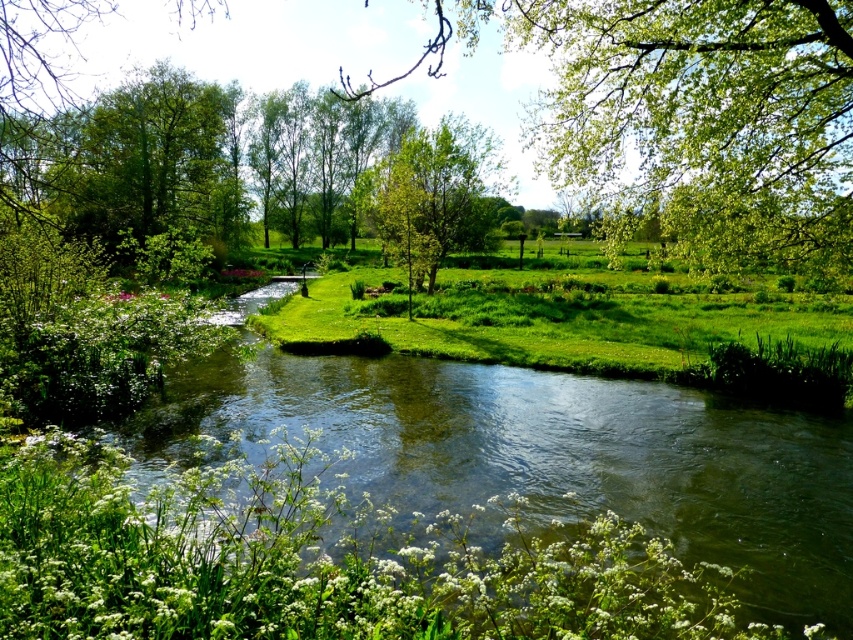
Who is shorter, green leafy tree at upper left or green leafy tree at center?

green leafy tree at center is shorter.

Which is above, green leafy tree at upper left or green leafy tree at center?

green leafy tree at upper left is higher up.

Is point (228, 188) positioned in front of point (477, 237)?

That is False.

This screenshot has height=640, width=853. What are the coordinates of `green leafy tree at upper left` in the screenshot? It's located at (149, 163).

Describe the element at coordinates (706, 113) in the screenshot. I see `green leafy tree at upper right` at that location.

This screenshot has height=640, width=853. What are the coordinates of `green leafy tree at upper right` in the screenshot? It's located at (706, 113).

Locate an element on the screen. Image resolution: width=853 pixels, height=640 pixels. green leafy tree at upper right is located at coordinates (706, 113).

Identify the location of green leafy tree at upper right. (706, 113).